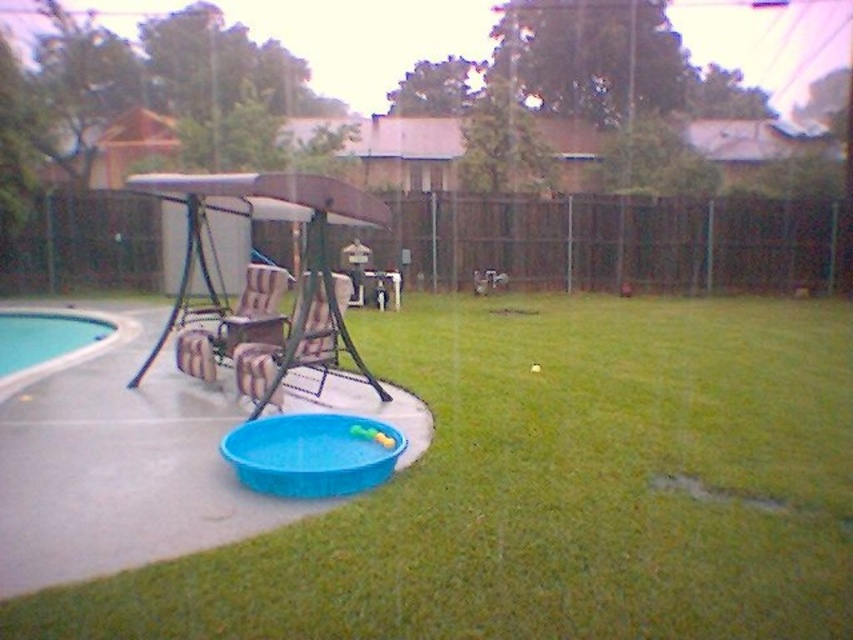
Based on the photo, can you confirm if green grass at center is wider than brown woven chair at center?

Yes.

What do you see at coordinates (553, 490) in the screenshot?
I see `green grass at center` at bounding box center [553, 490].

Does point (532, 544) come farther from viewer compared to point (248, 269)?

No.

In order to click on green grass at center in this screenshot , I will do `click(553, 490)`.

Can you confirm if blue plastic pool at lower center is positioned to the left of brown woven chair at center?

Incorrect, blue plastic pool at lower center is not on the left side of brown woven chair at center.

At what (x,y) coordinates should I click in order to perform the action: click on blue plastic pool at lower center. Please return your answer as a coordinate pair (x, y). Looking at the image, I should click on (312, 452).

Between point (280, 461) and point (219, 344), which one is positioned in front?

Point (280, 461) is in front.

Locate an element on the screen. The height and width of the screenshot is (640, 853). blue plastic pool at lower center is located at coordinates (312, 452).

Is blue plastic pool at lower center to the right of white smooth pool at lower left from the viewer's perspective?

Correct, you'll find blue plastic pool at lower center to the right of white smooth pool at lower left.

Does blue plastic pool at lower center appear on the left side of white smooth pool at lower left?

No, blue plastic pool at lower center is not to the left of white smooth pool at lower left.

Is point (364, 452) behind point (10, 340)?

No, (364, 452) is in front of (10, 340).

This screenshot has width=853, height=640. Identify the location of blue plastic pool at lower center. (312, 452).